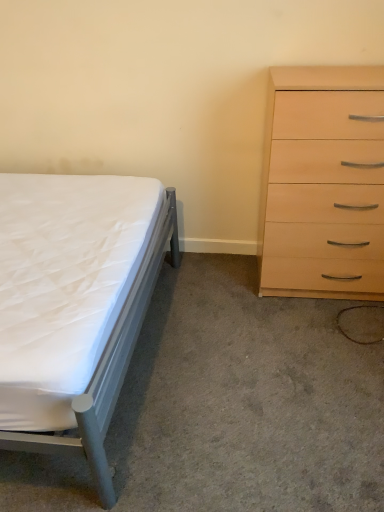
This screenshot has height=512, width=384. What are the coordinates of `white matte bed at left` in the screenshot? It's located at (74, 304).

Measure the distance between white fabric bed at left and camera.

A distance of 4.30 feet exists between white fabric bed at left and camera.

Where is `light wood/finish chest of drawers at right`? This screenshot has width=384, height=512. light wood/finish chest of drawers at right is located at coordinates (324, 184).

Considering the positions of objects light wood/finish chest of drawers at right and white fabric bed at left in the image provided, who is more to the right, light wood/finish chest of drawers at right or white fabric bed at left?

light wood/finish chest of drawers at right is more to the right.

Can you confirm if light wood/finish chest of drawers at right is thinner than white fabric bed at left?

Yes, light wood/finish chest of drawers at right is thinner than white fabric bed at left.

Does light wood/finish chest of drawers at right have a smaller size compared to white fabric bed at left?

No.

From the image's perspective, relative to light wood/finish chest of drawers at right, is white matte bed at left above or below?

From the image's perspective, white matte bed at left appears below light wood/finish chest of drawers at right.

Measure the distance from white matte bed at left to light wood/finish chest of drawers at right.

white matte bed at left and light wood/finish chest of drawers at right are 34.14 inches apart from each other.

Which of these two, white matte bed at left or light wood/finish chest of drawers at right, is bigger?

Bigger between the two is white matte bed at left.

Is white matte bed at left looking in the opposite direction of light wood/finish chest of drawers at right?

white matte bed at left does not have its back to light wood/finish chest of drawers at right.

Considering their positions, is white matte bed at left located in front of or behind white fabric bed at left?

white matte bed at left is positioned closer to the viewer than white fabric bed at left.

Is white matte bed at left bigger than white fabric bed at left?

Yes, white matte bed at left is bigger than white fabric bed at left.

From the image's perspective, is white matte bed at left located above or below white fabric bed at left?

Based on their image positions, white matte bed at left is located above white fabric bed at left.

Can you tell me how much white fabric bed at left and light wood/finish chest of drawers at right differ in facing direction?

The angular difference between white fabric bed at left and light wood/finish chest of drawers at right is 0.658 degrees.

Is white fabric bed at left at the left side of light wood/finish chest of drawers at right?

Correct, you'll find white fabric bed at left to the left of light wood/finish chest of drawers at right.

Does white fabric bed at left touch light wood/finish chest of drawers at right?

No, white fabric bed at left is not making contact with light wood/finish chest of drawers at right.

From a real-world perspective, who is located lower, white fabric bed at left or light wood/finish chest of drawers at right?

white fabric bed at left is physically lower.

Can you confirm if white fabric bed at left is wider than white matte bed at left?

Correct, the width of white fabric bed at left exceeds that of white matte bed at left.

Which object is closer to the camera taking this photo, white fabric bed at left or white matte bed at left?

white matte bed at left is closer to the camera.

Who is shorter, white fabric bed at left or white matte bed at left?

white fabric bed at left is shorter.

From a real-world perspective, is white fabric bed at left physically located above or below white matte bed at left?

white fabric bed at left is situated lower than white matte bed at left in the real world.

The width and height of the screenshot is (384, 512). Find the location of `bed lying below the light wood/finish chest of drawers at right (from the image's perspective)`. bed lying below the light wood/finish chest of drawers at right (from the image's perspective) is located at coordinates (74, 304).

From a real-world perspective, is light wood/finish chest of drawers at right on top of white matte bed at left?

Yes, from a real-world perspective, light wood/finish chest of drawers at right is above white matte bed at left.

From the image's perspective, is light wood/finish chest of drawers at right located above white matte bed at left?

Correct, light wood/finish chest of drawers at right appears higher than white matte bed at left in the image.

Does light wood/finish chest of drawers at right appear on the right side of white matte bed at left?

Correct, you'll find light wood/finish chest of drawers at right to the right of white matte bed at left.

Locate an element on the screen. The width and height of the screenshot is (384, 512). the chest of drawers that is behind the white fabric bed at left is located at coordinates (324, 184).

At what (x,y) coordinates should I click in order to perform the action: click on bed on the left side of light wood/finish chest of drawers at right. Please return your answer as a coordinate pair (x, y). Looking at the image, I should click on (74, 304).

From the image, which object appears to be nearer to white fabric bed at left, white matte bed at left or light wood/finish chest of drawers at right?

The object closer to white fabric bed at left is white matte bed at left.

Estimate the real-world distances between objects in this image. Which object is further from light wood/finish chest of drawers at right, white fabric bed at left or white matte bed at left?

Among the two, white matte bed at left is located further to light wood/finish chest of drawers at right.

Estimate the real-world distances between objects in this image. Which object is further from white matte bed at left, white fabric bed at left or light wood/finish chest of drawers at right?

The object further to white matte bed at left is light wood/finish chest of drawers at right.

Which object lies nearer to the anchor point white fabric bed at left, light wood/finish chest of drawers at right or white matte bed at left?

Based on the image, white matte bed at left appears to be nearer to white fabric bed at left.

From the image, which object appears to be nearer to white matte bed at left, light wood/finish chest of drawers at right or white fabric bed at left?

Among the two, white fabric bed at left is located nearer to white matte bed at left.

Estimate the real-world distances between objects in this image. Which object is closer to light wood/finish chest of drawers at right, white matte bed at left or white fabric bed at left?

white fabric bed at left lies closer to light wood/finish chest of drawers at right than the other object.

This screenshot has height=512, width=384. I want to click on concrete located between white matte bed at left and light wood/finish chest of drawers at right in the left-right direction, so click(246, 401).